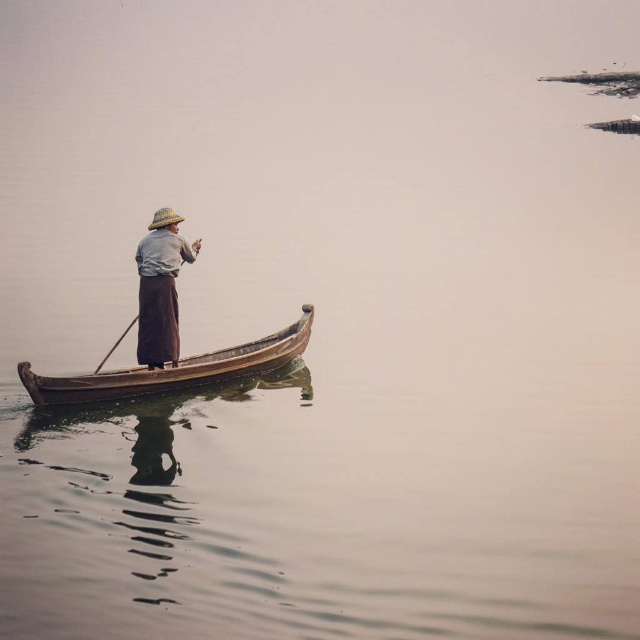
Is wooden canoe at center smaller than wooden paddle at center?

No, wooden canoe at center is not smaller than wooden paddle at center.

The width and height of the screenshot is (640, 640). I want to click on wooden canoe at center, so click(172, 371).

Find the location of a particular element. The height and width of the screenshot is (640, 640). wooden canoe at center is located at coordinates (172, 371).

Who is more forward, (182, 381) or (148, 365)?

Point (182, 381) is in front.

Can you confirm if wooden canoe at center is taller than brown woven hat at center?

In fact, wooden canoe at center may be shorter than brown woven hat at center.

Image resolution: width=640 pixels, height=640 pixels. I want to click on wooden canoe at center, so click(172, 371).

Where is `wooden canoe at center`? The width and height of the screenshot is (640, 640). wooden canoe at center is located at coordinates (172, 371).

Does brown woven hat at center appear under wooden paddle at center?

No.

Is brown woven hat at center further to camera compared to wooden paddle at center?

That is True.

Does point (150, 310) come farther from viewer compared to point (122, 333)?

No, it is in front of (122, 333).

Image resolution: width=640 pixels, height=640 pixels. Find the location of `brown woven hat at center`. brown woven hat at center is located at coordinates (161, 289).